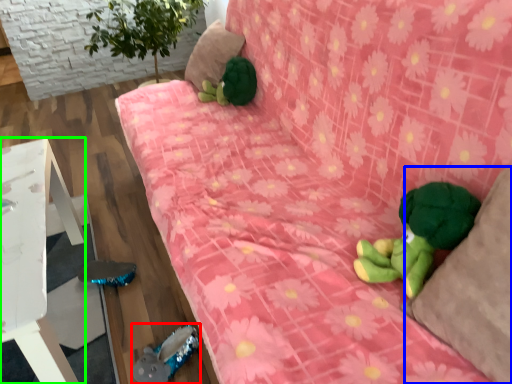
Question: Considering the real-world distances, which object is farthest from toy (highlighted by a red box)? pillow (highlighted by a blue box) or furniture (highlighted by a green box)?

Choices:
 (A) pillow
 (B) furniture

Answer: (A)